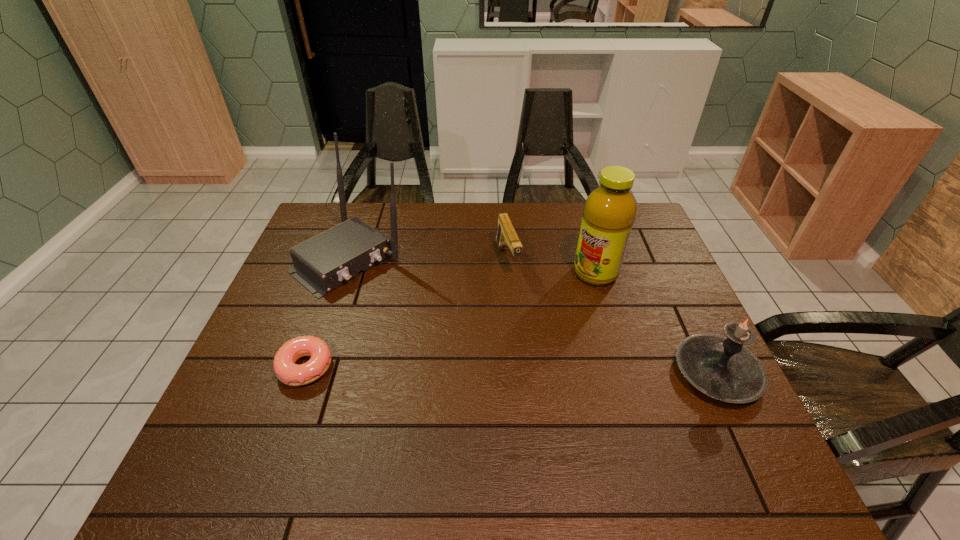
I want to click on vacant space that's between the shortest object and the rightmost object, so click(511, 370).

Locate an element on the screen. This screenshot has width=960, height=540. vacant area between the router and the fruit juice is located at coordinates (473, 266).

Point out which object is positioned as the fourth nearest to the router. Please provide its 2D coordinates. Your answer should be formatted as a tuple, i.e. [(x, y)], where the tuple contains the x and y coordinates of a point satisfying the conditions above.

[(722, 368)]

Identify the location of object that is the closest to the pistol. The width and height of the screenshot is (960, 540). (609, 212).

At what (x,y) coordinates should I click in order to perform the action: click on free space in the image that satisfies the following two spatial constraints: 1. on the front side of the third shortest object; 2. on the left side of the router. Please return your answer as a coordinate pair (x, y). Looking at the image, I should click on (311, 373).

Identify the location of vacant region that satisfies the following two spatial constraints: 1. on the front side of the rightmost object; 2. on the left side of the router. (311, 373).

Where is `vacant region that satisfies the following two spatial constraints: 1. on the front side of the router; 2. on the right side of the third shortest object`? This screenshot has height=540, width=960. vacant region that satisfies the following two spatial constraints: 1. on the front side of the router; 2. on the right side of the third shortest object is located at coordinates (311, 373).

At what (x,y) coordinates should I click in order to perform the action: click on vacant space that satisfies the following two spatial constraints: 1. on the front side of the router; 2. on the left side of the candle. Please return your answer as a coordinate pair (x, y). Looking at the image, I should click on (311, 373).